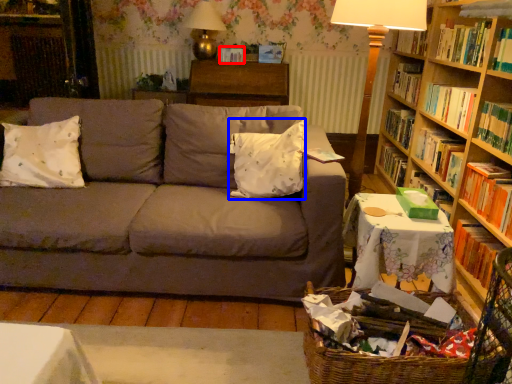
Question: Among these objects, which one is farthest to the camera, paperback book (highlighted by a red box) or pillow (highlighted by a blue box)?

Choices:
 (A) paperback book
 (B) pillow

Answer: (A)